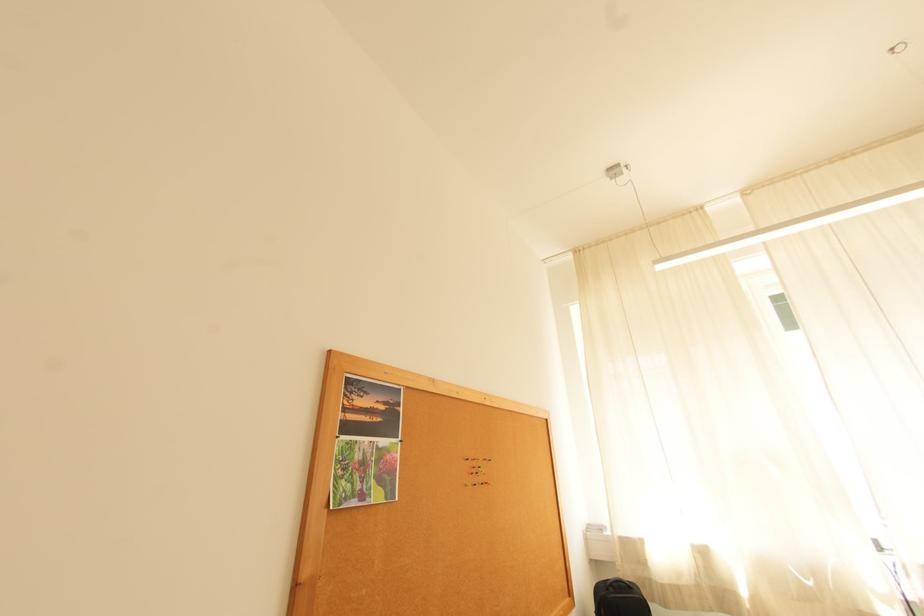
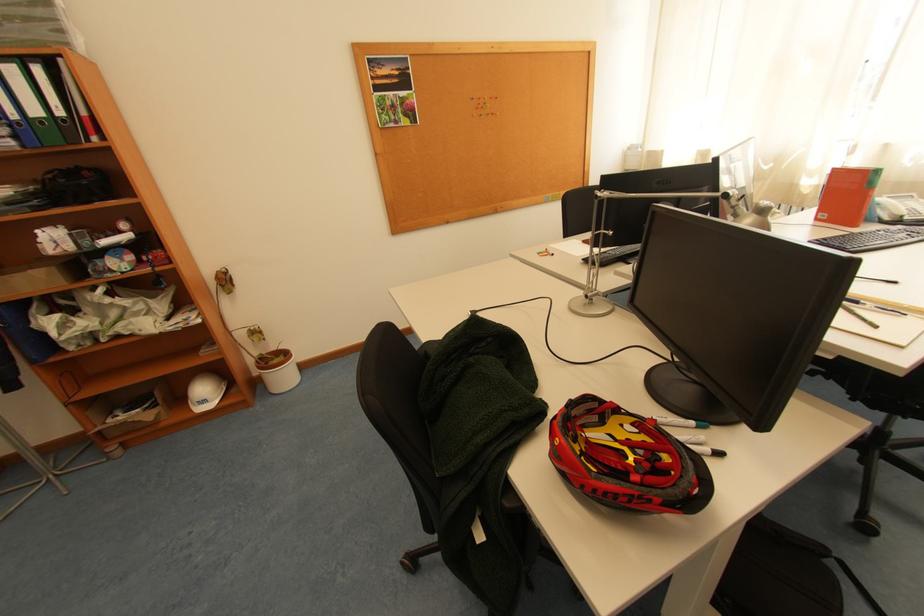
Where in the second image is the point corresponding to pixel 475 487 from the first image?

(481, 118)